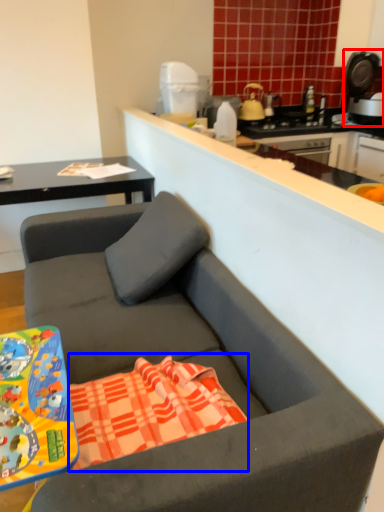
Question: Which of the following is the closest to the observer, coffee machine (highlighted by a red box) or beach towel (highlighted by a blue box)?

Choices:
 (A) coffee machine
 (B) beach towel

Answer: (B)